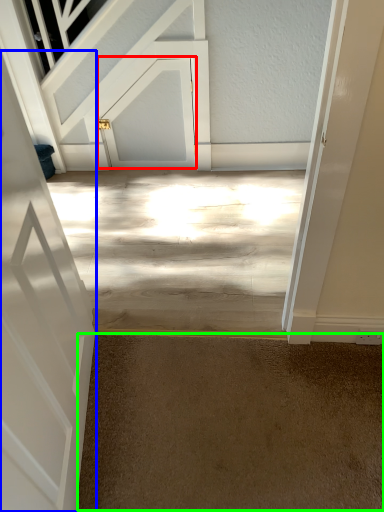
Question: Based on their relative distances, which object is farther from door (highlighted by a red box)? Choose from door (highlighted by a blue box) and concrete (highlighted by a green box).

Choices:
 (A) door
 (B) concrete

Answer: (B)